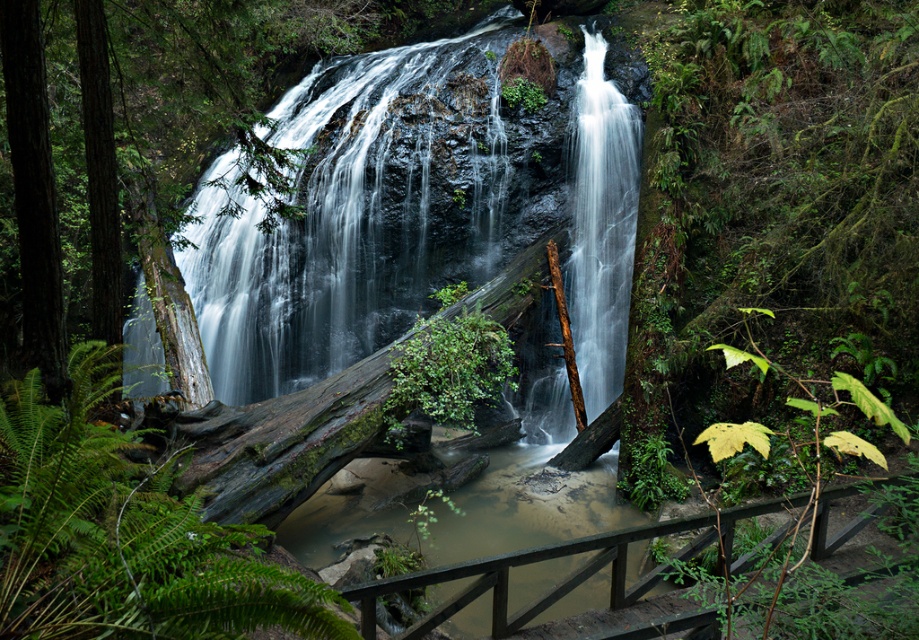
Between point (620, 134) and point (416, 355), which one is positioned behind?

The point (620, 134) is behind.

Can you confirm if white smooth water at center is smaller than green mossy log at center?

Actually, white smooth water at center might be larger than green mossy log at center.

Is point (588, 225) more distant than point (428, 337)?

Yes, it is.

Locate an element on the screen. This screenshot has width=919, height=640. white smooth water at center is located at coordinates (600, 227).

Can you confirm if green matte fern at center is positioned below brown wooden rail at lower center?

No, green matte fern at center is not below brown wooden rail at lower center.

Who is lower down, green matte fern at center or brown wooden rail at lower center?

brown wooden rail at lower center is lower down.

The image size is (919, 640). What are the coordinates of `green matte fern at center` in the screenshot? It's located at (123, 532).

Who is shorter, brown wooden rail at lower center or green mossy log at center?

Standing shorter between the two is brown wooden rail at lower center.

Does brown wooden rail at lower center have a greater width compared to green mossy log at center?

Yes, brown wooden rail at lower center is wider than green mossy log at center.

Is point (427, 572) in front of point (433, 330)?

Yes, point (427, 572) is closer to viewer.

Where is `brown wooden rail at lower center`? Image resolution: width=919 pixels, height=640 pixels. brown wooden rail at lower center is located at coordinates (568, 573).